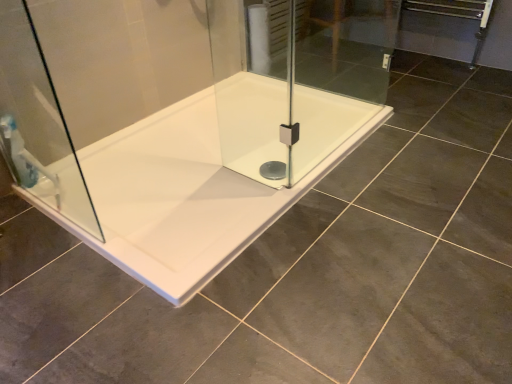
Question: From the image's perspective, would you say transparent glass shower door at left is shown under white glossy bathtub at center?

Choices:
 (A) yes
 (B) no

Answer: (B)

Question: Can you confirm if transparent glass shower door at left is positioned to the right of white glossy bathtub at center?

Choices:
 (A) no
 (B) yes

Answer: (A)

Question: Does transparent glass shower door at left have a lesser width compared to white glossy bathtub at center?

Choices:
 (A) no
 (B) yes

Answer: (B)

Question: Considering the relative sizes of transparent glass shower door at left and white glossy bathtub at center in the image provided, is transparent glass shower door at left smaller than white glossy bathtub at center?

Choices:
 (A) yes
 (B) no

Answer: (A)

Question: Is the position of transparent glass shower door at left more distant than that of white glossy bathtub at center?

Choices:
 (A) no
 (B) yes

Answer: (A)

Question: Considering the positions of translucent plastic shower at left and white glossy bathtub at center in the image, is translucent plastic shower at left taller or shorter than white glossy bathtub at center?

Choices:
 (A) short
 (B) tall

Answer: (B)

Question: In the image, is translucent plastic shower at left on the left side or the right side of white glossy bathtub at center?

Choices:
 (A) left
 (B) right

Answer: (A)

Question: From the image's perspective, is translucent plastic shower at left positioned above or below white glossy bathtub at center?

Choices:
 (A) above
 (B) below

Answer: (B)

Question: In the image, is translucent plastic shower at left positioned in front of or behind white glossy bathtub at center?

Choices:
 (A) behind
 (B) front

Answer: (A)

Question: Is point (186, 200) positioned closer to the camera than point (30, 170)?

Choices:
 (A) farther
 (B) closer

Answer: (A)

Question: Would you say white glossy bathtub at center is inside or outside translucent plastic shower at left?

Choices:
 (A) inside
 (B) outside

Answer: (B)

Question: Is white glossy bathtub at center taller or shorter than translucent plastic shower at left?

Choices:
 (A) tall
 (B) short

Answer: (B)

Question: Looking at their shapes, would you say white glossy bathtub at center is wider or thinner than translucent plastic shower at left?

Choices:
 (A) wide
 (B) thin

Answer: (A)

Question: From their relative heights in the image, would you say white glossy bathtub at center is taller or shorter than transparent glass shower door at left?

Choices:
 (A) short
 (B) tall

Answer: (A)

Question: Is white glossy bathtub at center wider or thinner than transparent glass shower door at left?

Choices:
 (A) thin
 (B) wide

Answer: (B)